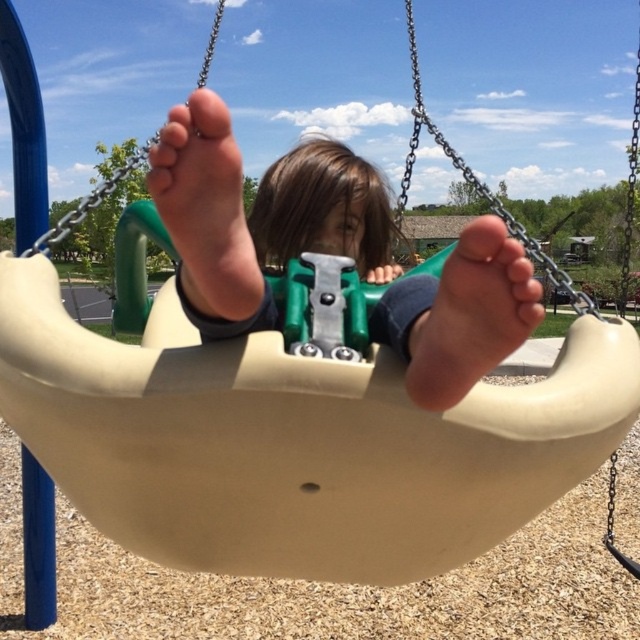
Is pink soft skin at center bigger than matte beige foot at center?

Actually, pink soft skin at center might be smaller than matte beige foot at center.

You are a GUI agent. You are given a task and a screenshot of the screen. Output one action in this format:
    pyautogui.click(x=<x>, y=<y>)
    Task: Click on the pink soft skin at center
    This screenshot has width=640, height=640.
    Given the screenshot: What is the action you would take?
    coord(472,316)

Where is `pink soft skin at center`? pink soft skin at center is located at coordinates (472, 316).

Is beige plastic swing at center shorter than pink soft skin at center?

No, beige plastic swing at center is not shorter than pink soft skin at center.

Which is behind, point (243, 250) or point (516, 300)?

The point (243, 250) is behind.

Identify the location of beige plastic swing at center. This screenshot has height=640, width=640. (256, 216).

Does beige plastic swing at center appear on the left side of matte beige foot at center?

Incorrect, beige plastic swing at center is not on the left side of matte beige foot at center.

Is beige plastic swing at center taller than matte beige foot at center?

Yes.

Is point (323, 145) positioned before point (202, 173)?

No.

Where is `beige plastic swing at center`? This screenshot has width=640, height=640. beige plastic swing at center is located at coordinates (256, 216).